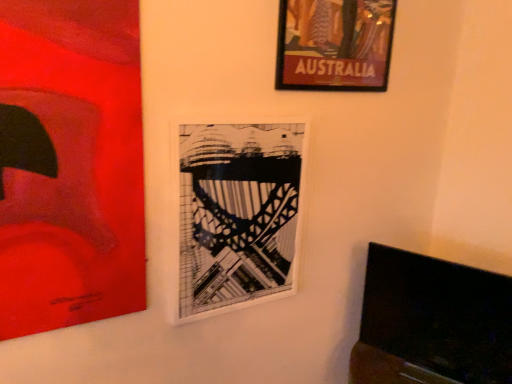
What do you see at coordinates (236, 213) in the screenshot?
I see `white matte picture frame at center, which is the second picture frame from right to left` at bounding box center [236, 213].

Measure the distance between white matte picture frame at center, which ranks as the 2th picture frame in left-to-right order, and camera.

They are 1.35 meters apart.

Describe the element at coordinates (70, 164) in the screenshot. Image resolution: width=512 pixels, height=384 pixels. I see `matte red painting at left, which appears as the first picture frame when viewed from the left` at that location.

You are a GUI agent. You are given a task and a screenshot of the screen. Output one action in this format:
    pyautogui.click(x=<x>, y=<y>)
    Task: Click on the white matte picture frame at center, which ranks as the 2th picture frame in left-to-right order
    The height and width of the screenshot is (384, 512).
    Given the screenshot: What is the action you would take?
    pyautogui.click(x=236, y=213)

Would you consider wooden-framed poster at upper right, positioned as the 1th picture frame in right-to-left order, to be distant from matte red painting at left, which appears as the 3th picture frame when viewed from the right?

No, wooden-framed poster at upper right, positioned as the 1th picture frame in right-to-left order, is not far away from matte red painting at left, which appears as the 3th picture frame when viewed from the right.

Considering the sizes of wooden-framed poster at upper right, positioned as the 1th picture frame in right-to-left order, and matte red painting at left, which appears as the 3th picture frame when viewed from the right, in the image, is wooden-framed poster at upper right, positioned as the 1th picture frame in right-to-left order, bigger or smaller than matte red painting at left, which appears as the 3th picture frame when viewed from the right,?

Answer: In the image, wooden-framed poster at upper right, positioned as the 1th picture frame in right-to-left order, appears to be smaller than matte red painting at left, which appears as the 3th picture frame when viewed from the right.

From the image's perspective, which is above, wooden-framed poster at upper right, arranged as the third picture frame when viewed from the left, or matte red painting at left, which appears as the 3th picture frame when viewed from the right?

wooden-framed poster at upper right, arranged as the third picture frame when viewed from the left.

From a real-world perspective, is wooden-framed poster at upper right, arranged as the third picture frame when viewed from the left, above or below matte red painting at left, which appears as the 3th picture frame when viewed from the right?

wooden-framed poster at upper right, arranged as the third picture frame when viewed from the left, is above matte red painting at left, which appears as the 3th picture frame when viewed from the right.

Can you confirm if matte red painting at left, which appears as the first picture frame when viewed from the left, is taller than white matte picture frame at center, which is the second picture frame from right to left?

Yes, matte red painting at left, which appears as the first picture frame when viewed from the left, is taller than white matte picture frame at center, which is the second picture frame from right to left.

From the image's perspective, is matte red painting at left, which appears as the 3th picture frame when viewed from the right, over white matte picture frame at center, which ranks as the 2th picture frame in left-to-right order?

Yes, from the image's perspective, matte red painting at left, which appears as the 3th picture frame when viewed from the right, is above white matte picture frame at center, which ranks as the 2th picture frame in left-to-right order.

Is matte red painting at left, which appears as the 3th picture frame when viewed from the right, far from white matte picture frame at center, which ranks as the 2th picture frame in left-to-right order?

matte red painting at left, which appears as the 3th picture frame when viewed from the right, is near white matte picture frame at center, which ranks as the 2th picture frame in left-to-right order, not far away.

Would you say white matte picture frame at center, which ranks as the 2th picture frame in left-to-right order, is a long distance from matte red painting at left, which appears as the 3th picture frame when viewed from the right?

No.

The image size is (512, 384). I want to click on picture frame below the matte red painting at left, which appears as the first picture frame when viewed from the left (from the image's perspective), so click(236, 213).

From a real-world perspective, is white matte picture frame at center, which ranks as the 2th picture frame in left-to-right order, positioned under matte red painting at left, which appears as the first picture frame when viewed from the left, based on gravity?

Yes, from a real-world perspective, white matte picture frame at center, which ranks as the 2th picture frame in left-to-right order, is beneath matte red painting at left, which appears as the first picture frame when viewed from the left.

In terms of width, does white matte picture frame at center, which ranks as the 2th picture frame in left-to-right order, look wider or thinner when compared to matte red painting at left, which appears as the 3th picture frame when viewed from the right?

Clearly, white matte picture frame at center, which ranks as the 2th picture frame in left-to-right order, has less width compared to matte red painting at left, which appears as the 3th picture frame when viewed from the right.

Which is in front, point (99, 166) or point (375, 40)?

The point (99, 166) is in front.

Is matte red painting at left, which appears as the 3th picture frame when viewed from the right, not inside wooden-framed poster at upper right, arranged as the third picture frame when viewed from the left?

That's correct, matte red painting at left, which appears as the 3th picture frame when viewed from the right, is outside of wooden-framed poster at upper right, arranged as the third picture frame when viewed from the left.

Is matte red painting at left, which appears as the first picture frame when viewed from the left, aimed at wooden-framed poster at upper right, positioned as the 1th picture frame in right-to-left order?

No, matte red painting at left, which appears as the first picture frame when viewed from the left, is not facing towards wooden-framed poster at upper right, positioned as the 1th picture frame in right-to-left order.

Which object is thinner, wooden-framed poster at upper right, positioned as the 1th picture frame in right-to-left order, or white matte picture frame at center, which ranks as the 2th picture frame in left-to-right order?

Thinner between the two is white matte picture frame at center, which ranks as the 2th picture frame in left-to-right order.

Locate an element on the screen. Image resolution: width=512 pixels, height=384 pixels. picture frame behind the white matte picture frame at center, which is the second picture frame from right to left is located at coordinates (334, 44).

Who is shorter, wooden-framed poster at upper right, positioned as the 1th picture frame in right-to-left order, or white matte picture frame at center, which is the second picture frame from right to left?

With less height is wooden-framed poster at upper right, positioned as the 1th picture frame in right-to-left order.

Is wooden-framed poster at upper right, positioned as the 1th picture frame in right-to-left order, looking in the opposite direction of white matte picture frame at center, which ranks as the 2th picture frame in left-to-right order?

wooden-framed poster at upper right, positioned as the 1th picture frame in right-to-left order, is not turned away from white matte picture frame at center, which ranks as the 2th picture frame in left-to-right order.

Between white matte picture frame at center, which is the second picture frame from right to left, and wooden-framed poster at upper right, arranged as the third picture frame when viewed from the left, which one has more height?

white matte picture frame at center, which is the second picture frame from right to left.

From a real-world perspective, does white matte picture frame at center, which ranks as the 2th picture frame in left-to-right order, stand above wooden-framed poster at upper right, positioned as the 1th picture frame in right-to-left order?

No, from a real-world perspective, white matte picture frame at center, which ranks as the 2th picture frame in left-to-right order, is not over wooden-framed poster at upper right, positioned as the 1th picture frame in right-to-left order

Between point (210, 301) and point (286, 31), which one is positioned behind?

The point (210, 301) is farther.

Can you confirm if white matte picture frame at center, which is the second picture frame from right to left, is wider than wooden-framed poster at upper right, arranged as the third picture frame when viewed from the left?

No.

Which picture frame is the 2nd one when counting from the back of the matte red painting at left, which appears as the 3th picture frame when viewed from the right? Please provide its 2D coordinates.

[(334, 44)]

There is a white matte picture frame at center, which ranks as the 2th picture frame in left-to-right order. At what (x,y) coordinates should I click in order to perform the action: click on the 1st picture frame above it (from the image's perspective). Please return your answer as a coordinate pair (x, y). The height and width of the screenshot is (384, 512). Looking at the image, I should click on (70, 164).

Based on the photo, which object lies further to the anchor point matte red painting at left, which appears as the 3th picture frame when viewed from the right, white matte picture frame at center, which is the second picture frame from right to left, or wooden-framed poster at upper right, positioned as the 1th picture frame in right-to-left order?

wooden-framed poster at upper right, positioned as the 1th picture frame in right-to-left order, is positioned further to the anchor matte red painting at left, which appears as the 3th picture frame when viewed from the right.

From the image, which object appears to be farther from white matte picture frame at center, which ranks as the 2th picture frame in left-to-right order, matte red painting at left, which appears as the 3th picture frame when viewed from the right, or wooden-framed poster at upper right, positioned as the 1th picture frame in right-to-left order?

wooden-framed poster at upper right, positioned as the 1th picture frame in right-to-left order, is positioned further to the anchor white matte picture frame at center, which ranks as the 2th picture frame in left-to-right order.

Based on their spatial positions, is wooden-framed poster at upper right, positioned as the 1th picture frame in right-to-left order, or white matte picture frame at center, which is the second picture frame from right to left, further from matte red painting at left, which appears as the 3th picture frame when viewed from the right?

wooden-framed poster at upper right, positioned as the 1th picture frame in right-to-left order, is further to matte red painting at left, which appears as the 3th picture frame when viewed from the right.

Which object lies further to the anchor point wooden-framed poster at upper right, positioned as the 1th picture frame in right-to-left order, matte red painting at left, which appears as the 3th picture frame when viewed from the right, or white matte picture frame at center, which ranks as the 2th picture frame in left-to-right order?

Based on the image, matte red painting at left, which appears as the 3th picture frame when viewed from the right, appears to be further to wooden-framed poster at upper right, positioned as the 1th picture frame in right-to-left order.

Considering their positions, is white matte picture frame at center, which is the second picture frame from right to left, positioned closer to wooden-framed poster at upper right, positioned as the 1th picture frame in right-to-left order, than matte red painting at left, which appears as the 3th picture frame when viewed from the right?

The object closer to wooden-framed poster at upper right, positioned as the 1th picture frame in right-to-left order, is white matte picture frame at center, which is the second picture frame from right to left.

In the scene shown: From the image, which object appears to be nearer to white matte picture frame at center, which is the second picture frame from right to left, wooden-framed poster at upper right, arranged as the third picture frame when viewed from the left, or matte red painting at left, which appears as the first picture frame when viewed from the left?

matte red painting at left, which appears as the first picture frame when viewed from the left, lies closer to white matte picture frame at center, which is the second picture frame from right to left, than the other object.

The height and width of the screenshot is (384, 512). Find the location of `picture frame between matte red painting at left, which appears as the first picture frame when viewed from the left, and wooden-framed poster at upper right, positioned as the 1th picture frame in right-to-left order, from left to right`. picture frame between matte red painting at left, which appears as the first picture frame when viewed from the left, and wooden-framed poster at upper right, positioned as the 1th picture frame in right-to-left order, from left to right is located at coordinates [236, 213].